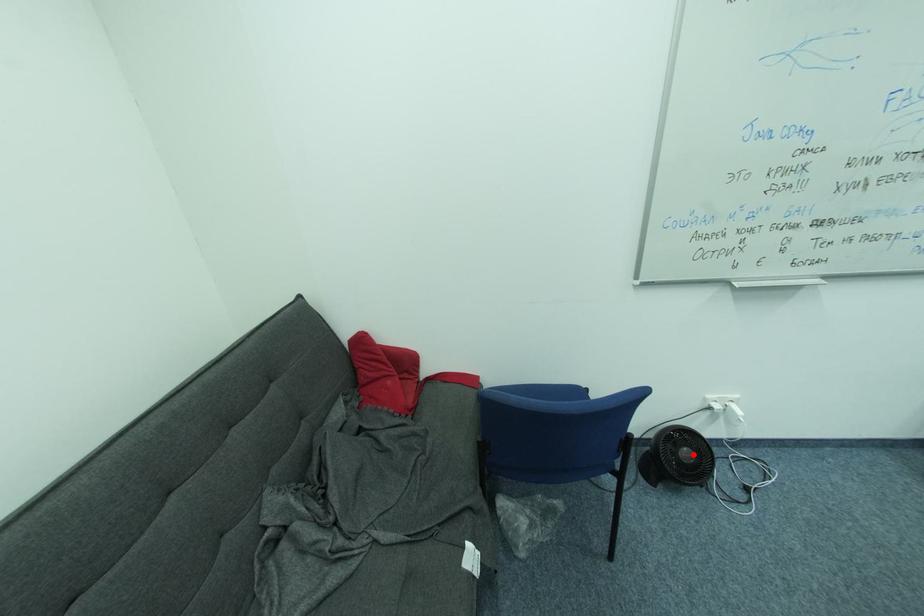
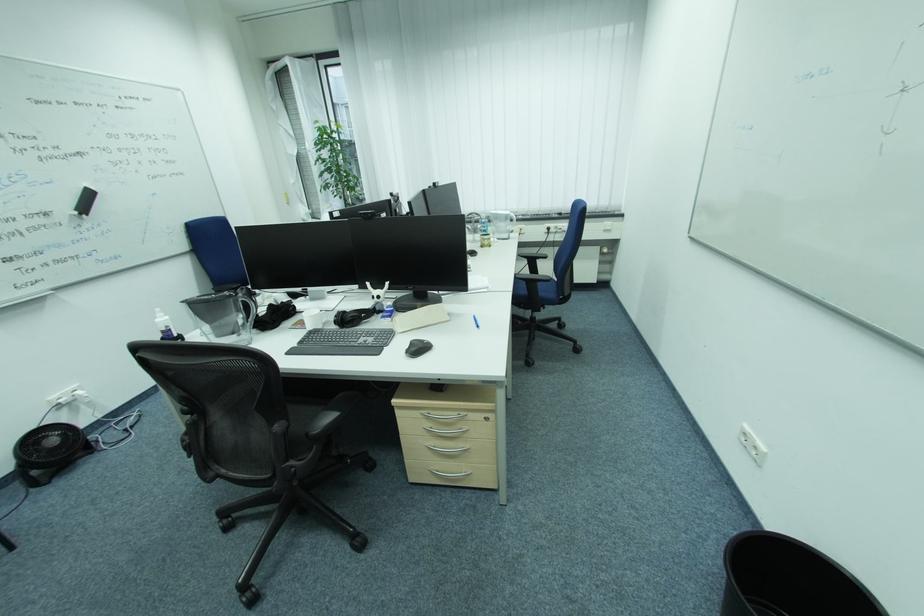
Question: I am providing you with two images of the same scene from different viewpoints. In image1, a red point is highlighted. Considering the same 3D point in image2, which of the following is correct?

Choices:
 (A) It is closer
 (B) It is farther

Answer: (B)